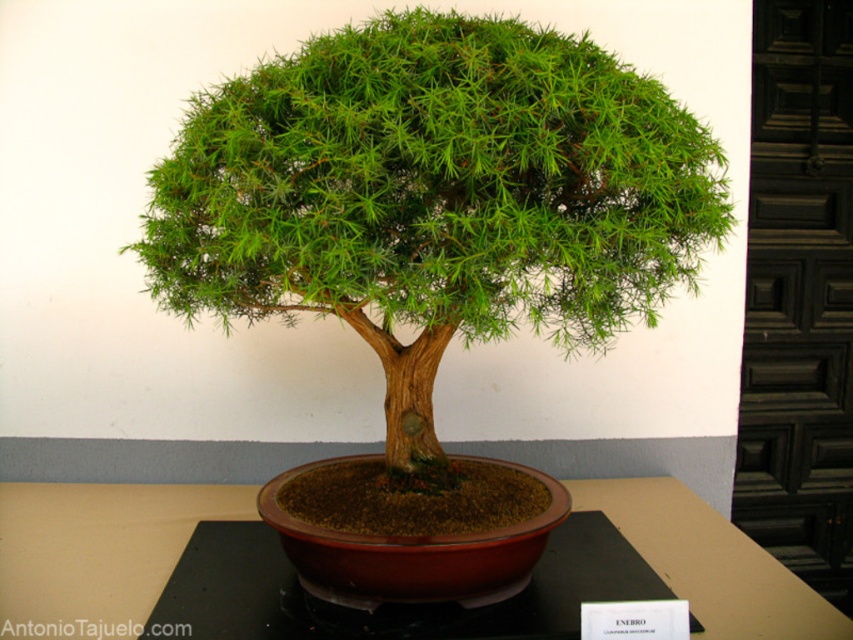
Question: Among these objects, which one is nearest to the camera?

Choices:
 (A) green textured bonsai tree at center
 (B) brown wooden table at center

Answer: (A)

Question: Can you confirm if green textured bonsai tree at center is smaller than brown wooden table at center?

Choices:
 (A) no
 (B) yes

Answer: (A)

Question: Which of the following is the closest to the observer?

Choices:
 (A) brown wooden table at center
 (B) green textured bonsai tree at center

Answer: (B)

Question: Can you confirm if green textured bonsai tree at center is thinner than brown wooden table at center?

Choices:
 (A) no
 (B) yes

Answer: (A)

Question: Which point is farther to the camera?

Choices:
 (A) green textured bonsai tree at center
 (B) brown wooden table at center

Answer: (B)

Question: Does green textured bonsai tree at center have a smaller size compared to brown wooden table at center?

Choices:
 (A) yes
 (B) no

Answer: (B)